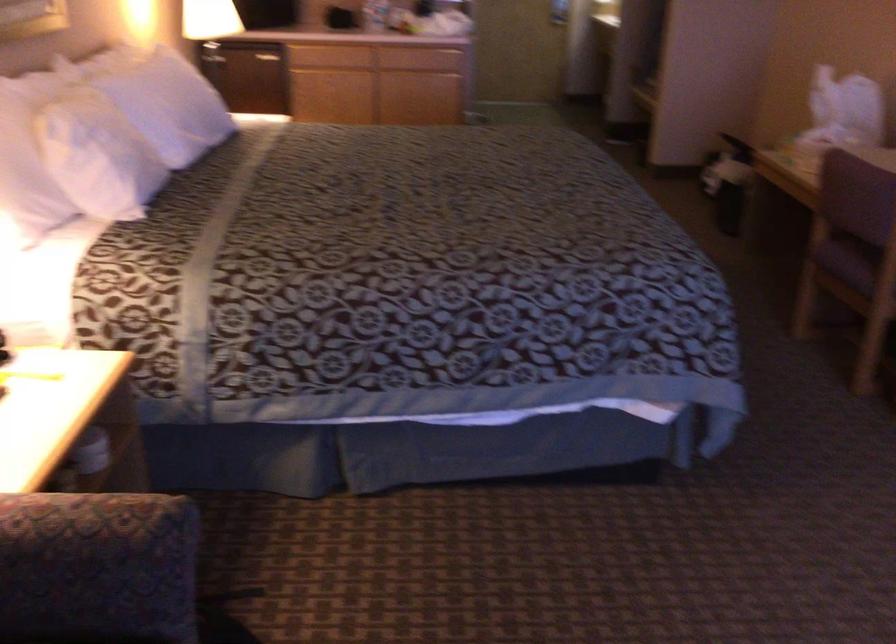
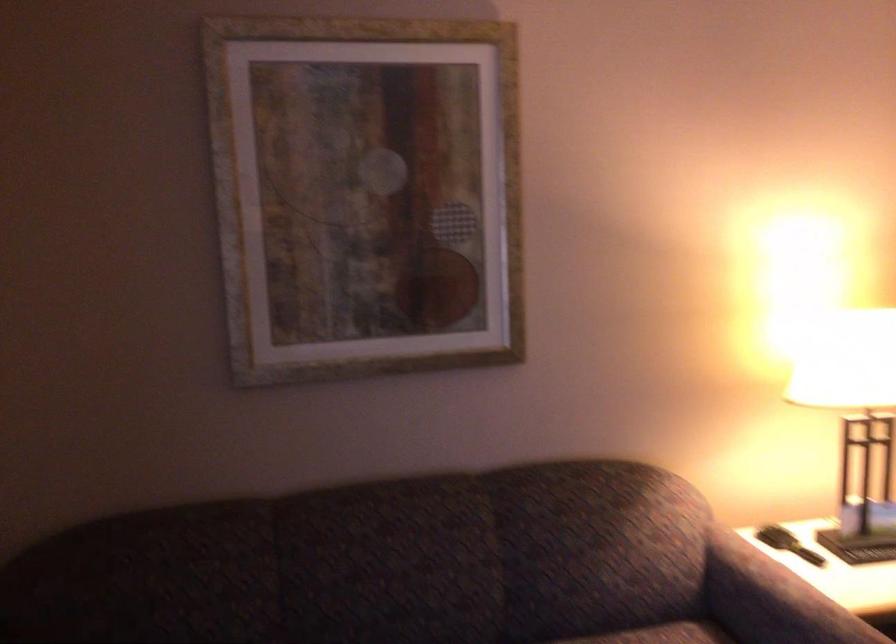
Question: Based on the continuous images, in which direction is the camera rotating? Reply with the corresponding letter.

Choices:
 (A) Left
 (B) Right
 (C) Up
 (D) Down

Answer: (A)